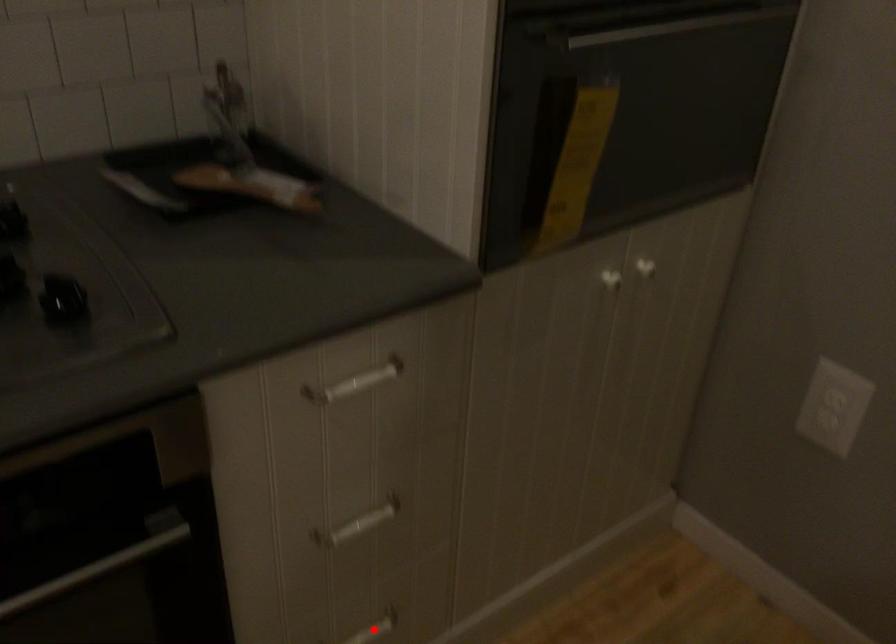
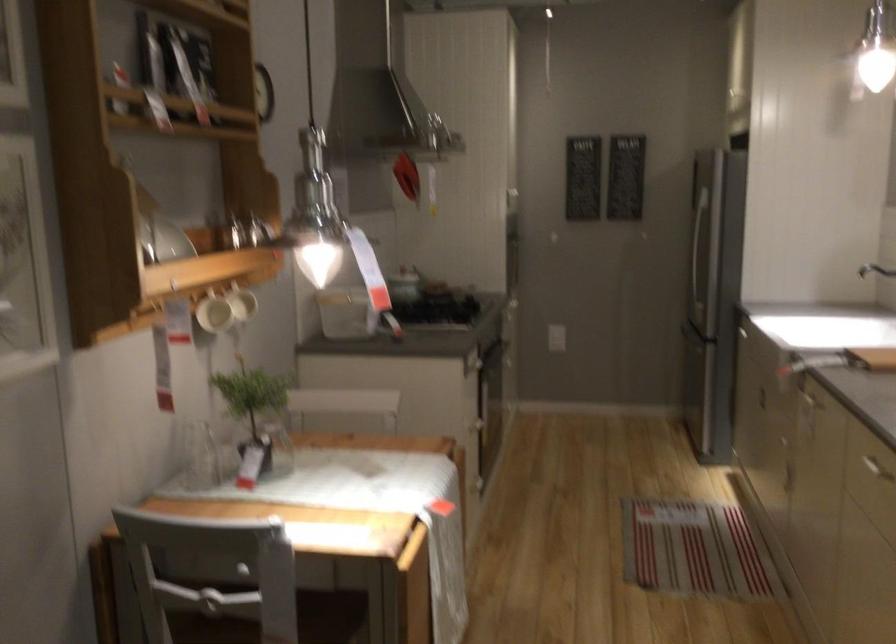
Question: I am providing you with two images of the same scene from different viewpoints. A red point is marked on the first image. Is the red point's position out of view in image 2?

Choices:
 (A) Yes
 (B) No

Answer: (A)